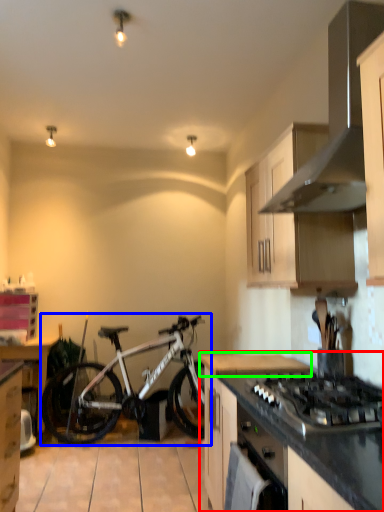
Question: Considering the real-world distances, which object is farthest from countertop (highlighted by a red box)? bicycle (highlighted by a blue box) or countertop (highlighted by a green box)?

Choices:
 (A) bicycle
 (B) countertop

Answer: (A)